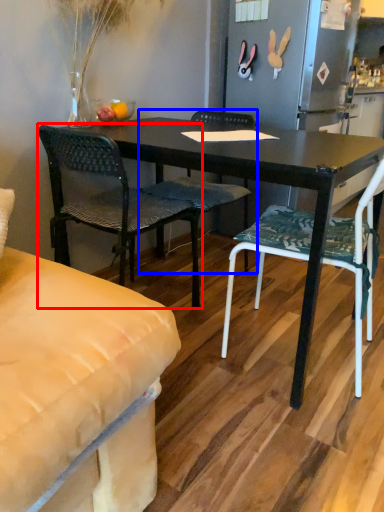
Question: Which object is further to the camera taking this photo, chair (highlighted by a red box) or chair (highlighted by a blue box)?

Choices:
 (A) chair
 (B) chair

Answer: (B)